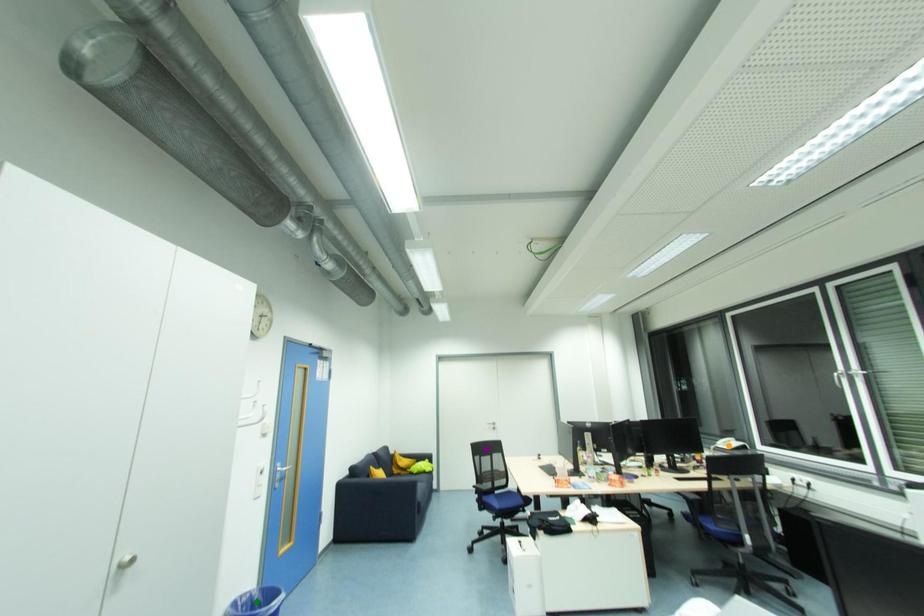
Order these from nearest to farthest:
- green point
- purple point
- orange point

green point < orange point < purple point